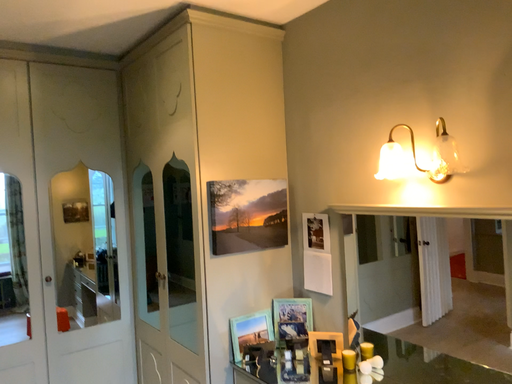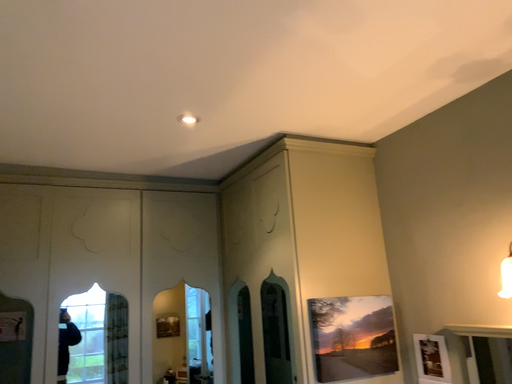
Question: How did the camera likely rotate when shooting the video?

Choices:
 (A) rotated upward
 (B) rotated downward

Answer: (A)